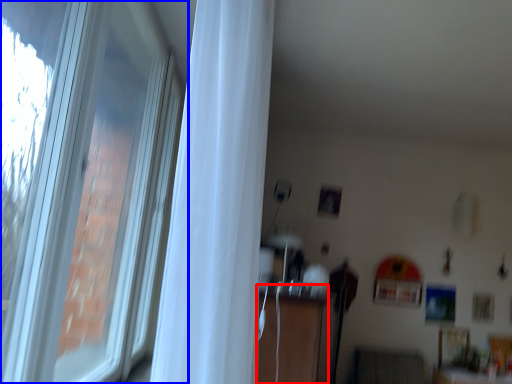
Question: Among these objects, which one is nearest to the camera, dresser (highlighted by a red box) or window (highlighted by a blue box)?

Choices:
 (A) dresser
 (B) window

Answer: (B)